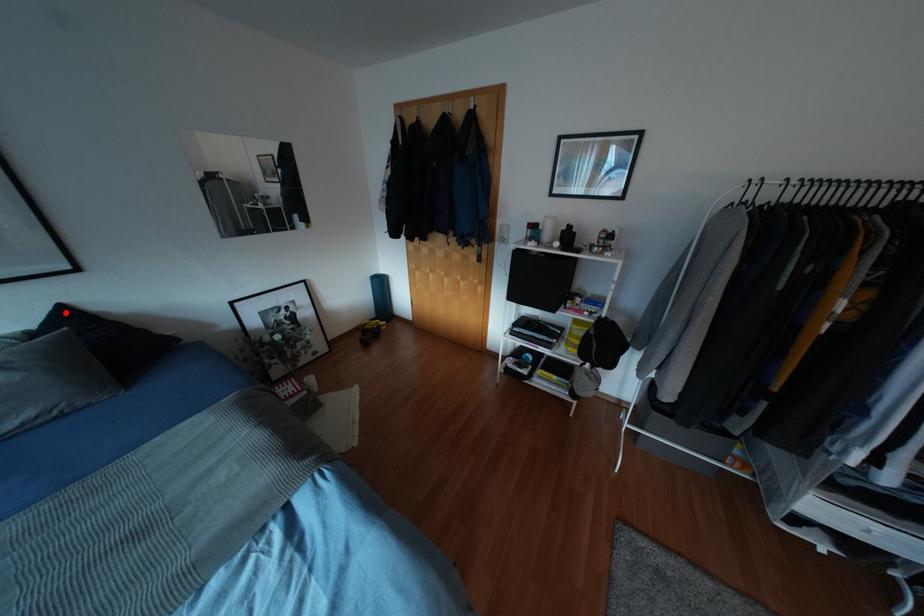
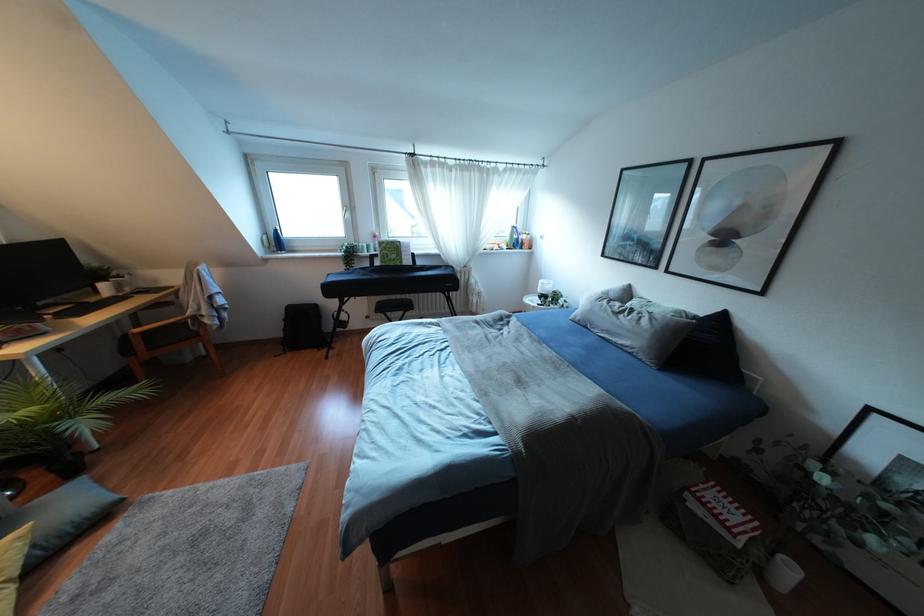
In the second image, find the point that corresponds to the highlighted location in the first image.

(722, 317)